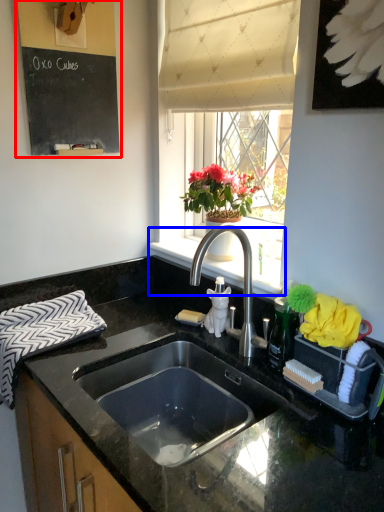
Question: Among these objects, which one is farthest to the camera, bulletin board (highlighted by a red box) or window sill (highlighted by a blue box)?

Choices:
 (A) bulletin board
 (B) window sill

Answer: (B)